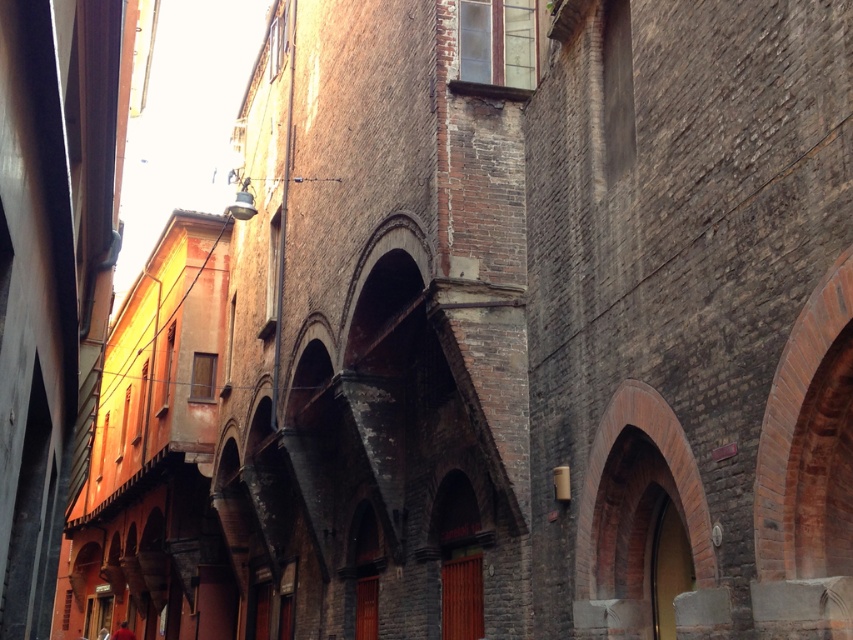
You are standing at point A, which is located at coordinates (666, 464). Looking around, you notice a brick textured archway at center. Can you determine the direction of the archway relative to your current position?

The brick textured archway at center is located directly in front of you since you are standing at point A, which is exactly where the archway is positioned.

You are a tourist standing at the entrance of the narrow street. You see the brick textured archway at center and the red cloth at lower left. Which object is positioned to the right of the other?

The brick textured archway at center is to the right of red cloth at lower left.

You are a painter standing in the middle of the narrow street. You notice the brick textured archway at center and the red cloth at lower left. Which object would you say is narrower from your current position?

The brick textured archway at center is thinner than the red cloth at lower left, so it is narrower.